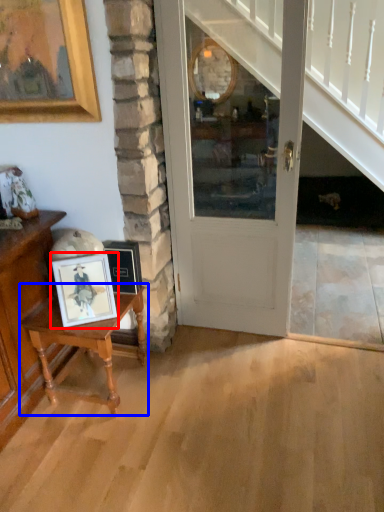
Question: Which object appears farthest to the camera in this image, picture frame (highlighted by a red box) or table (highlighted by a blue box)?

Choices:
 (A) picture frame
 (B) table

Answer: (B)